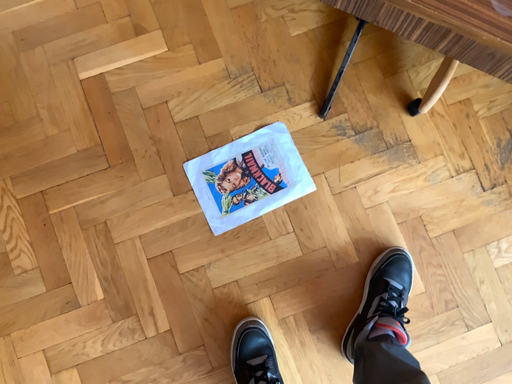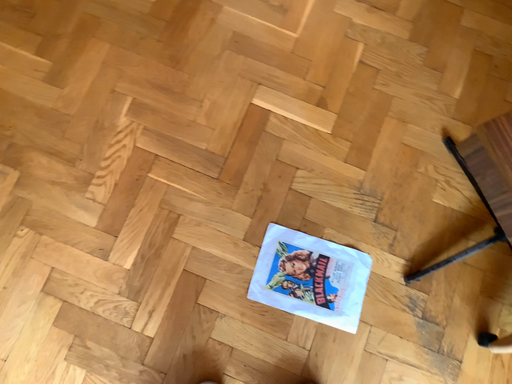
Question: How did the camera likely rotate when shooting the video?

Choices:
 (A) rotated upward
 (B) rotated downward

Answer: (A)